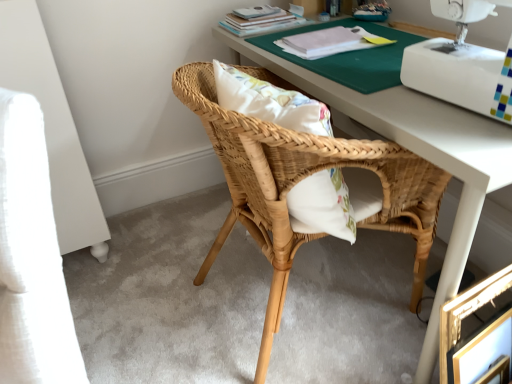
Where is `vacant area that lies in front of white paper at upper center, acting as the second book starting from the back`? This screenshot has width=512, height=384. vacant area that lies in front of white paper at upper center, acting as the second book starting from the back is located at coordinates (352, 68).